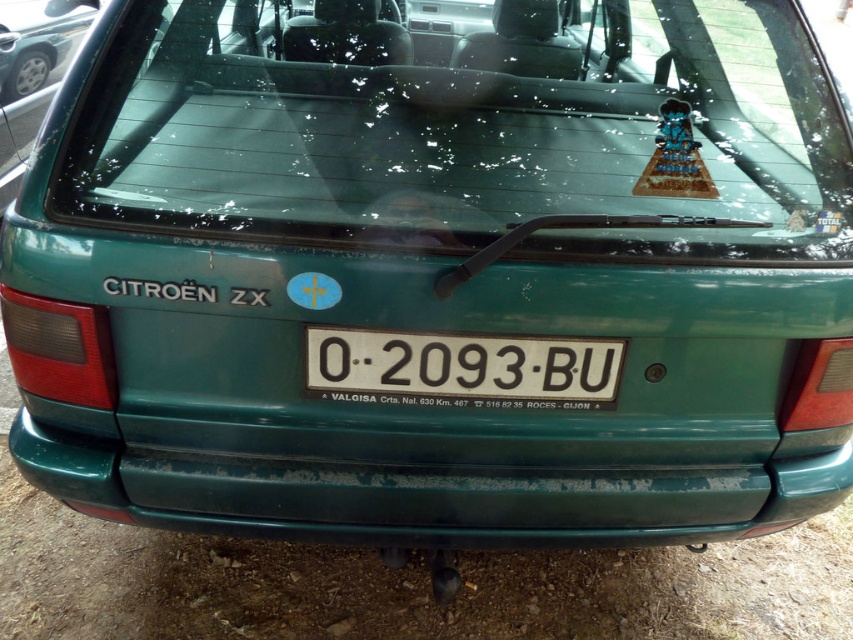
You are standing in front of a Citroen ZX car. You see the green matte bumper at lower center and the green matte car at upper center. Which object is positioned to the right side?

The green matte bumper at lower center is to the right of the green matte car at upper center.

You are a delivery person trying to load a package onto the Citroen ZX car. The package must be placed on the bumper without blocking the car itself. Given the spatial relationship between the green matte bumper at lower center and the green matte car at upper center, is this possible?

The green matte bumper at lower center is in front of the green matte car at upper center, so placing the package on the bumper would not block the car itself. This placement is possible.

You are a pedestrian standing behind the Citroen ZX car. You want to see the white plastic license plate at center. Can you see it through the transparent glass windshield at upper center?

The transparent glass windshield at upper center is in front of the white plastic license plate at center, so yes, you can see the white plastic license plate at center through the transparent glass windshield at upper center because it is transparent.